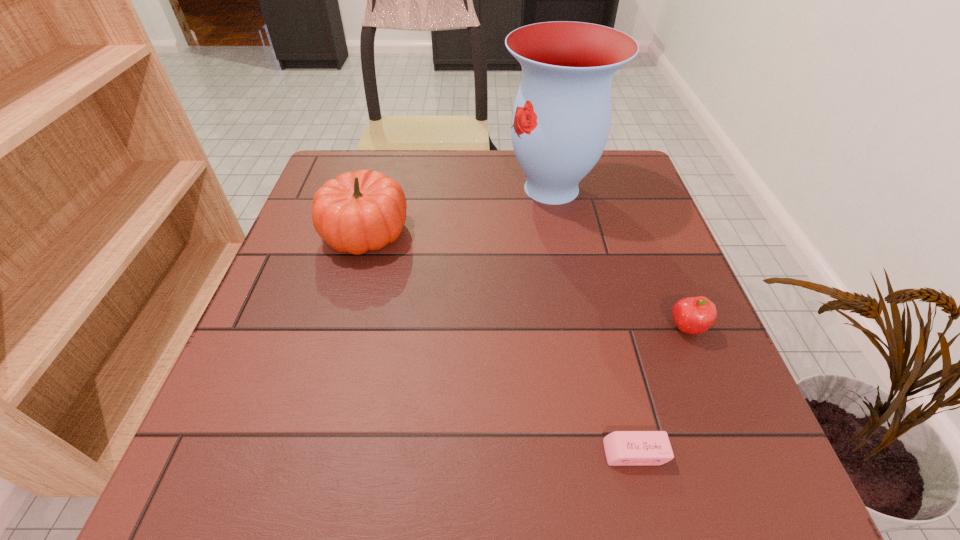
Find the location of a particular element. vacant region between the nearest object and the leftmost object is located at coordinates (x=500, y=342).

Identify the location of vacant space that's between the third tallest object and the pumpkin. (526, 280).

I want to click on free space between the leftmost object and the tallest object, so click(x=458, y=210).

Find the location of `vacant space that is in between the pumpkin and the nearest object`. vacant space that is in between the pumpkin and the nearest object is located at coordinates (500, 342).

You are a GUI agent. You are given a task and a screenshot of the screen. Output one action in this format:
    pyautogui.click(x=<x>, y=<y>)
    Task: Click on the vacant point located between the second tallest object and the vase
    The height and width of the screenshot is (540, 960).
    Given the screenshot: What is the action you would take?
    pyautogui.click(x=458, y=210)

Identify which object is located as the second nearest to the second shortest object. Please provide its 2D coordinates. Your answer should be formatted as a tuple, i.e. [(x, y)], where the tuple contains the x and y coordinates of a point satisfying the conditions above.

[(561, 119)]

Locate an element on the screen. This screenshot has width=960, height=540. object that can be found as the third closest to the apple is located at coordinates (356, 212).

Identify the location of vacant space that satisfies the following two spatial constraints: 1. on the back side of the eraser; 2. on the right side of the third tallest object. This screenshot has height=540, width=960. (605, 328).

Locate an element on the screen. blank space that satisfies the following two spatial constraints: 1. on the back side of the third shortest object; 2. on the left side of the vase is located at coordinates (377, 188).

Find the location of `vacant space that satisfies the following two spatial constraints: 1. on the front side of the vase; 2. on the right side of the eraser`. vacant space that satisfies the following two spatial constraints: 1. on the front side of the vase; 2. on the right side of the eraser is located at coordinates (603, 453).